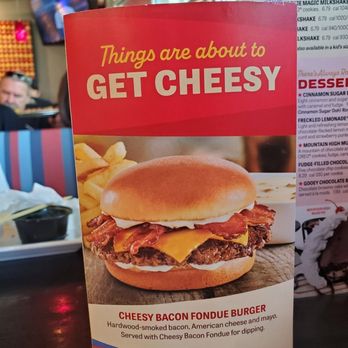
The height and width of the screenshot is (348, 348). Find the location of `plate`. plate is located at coordinates (48, 247).